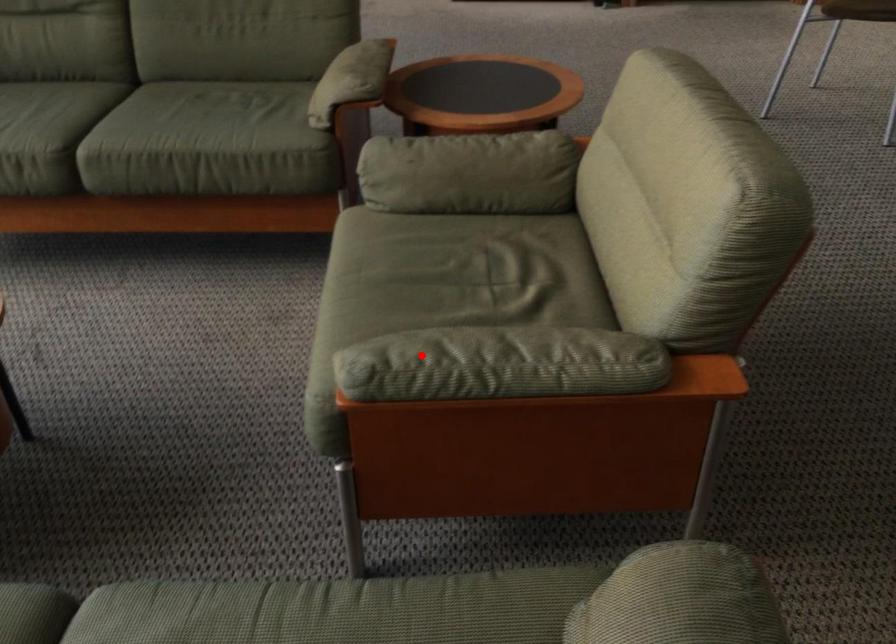
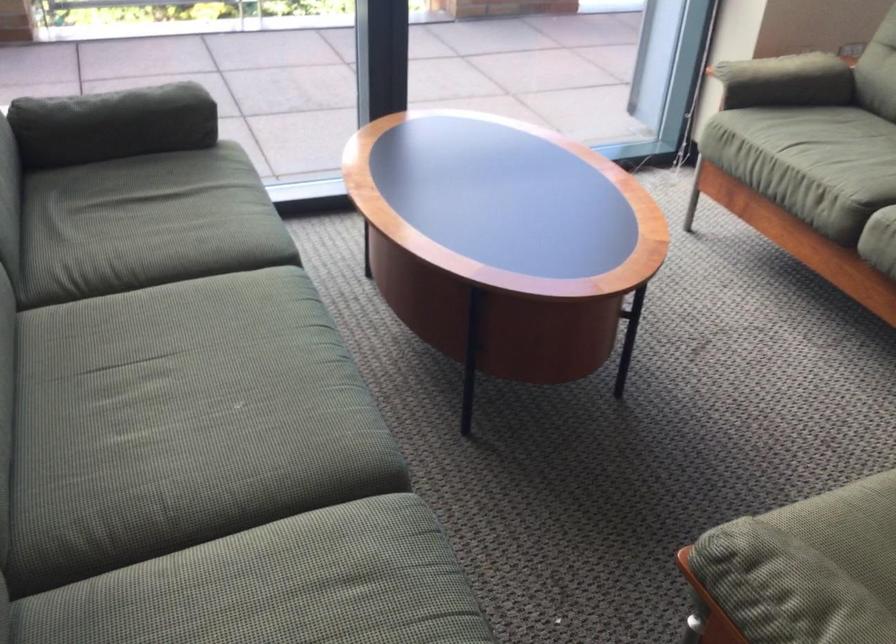
Question: I am providing you with two images of the same scene from different viewpoints. Given a red point in image1, look at the same physical point in image2. Is it:

Choices:
 (A) Closer to the viewpoint
 (B) Farther from the viewpoint

Answer: (A)